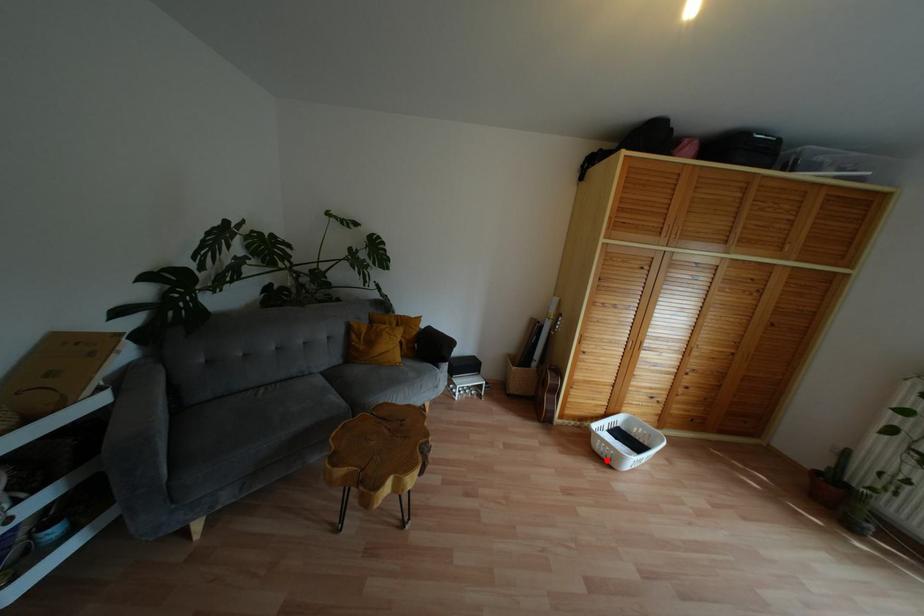
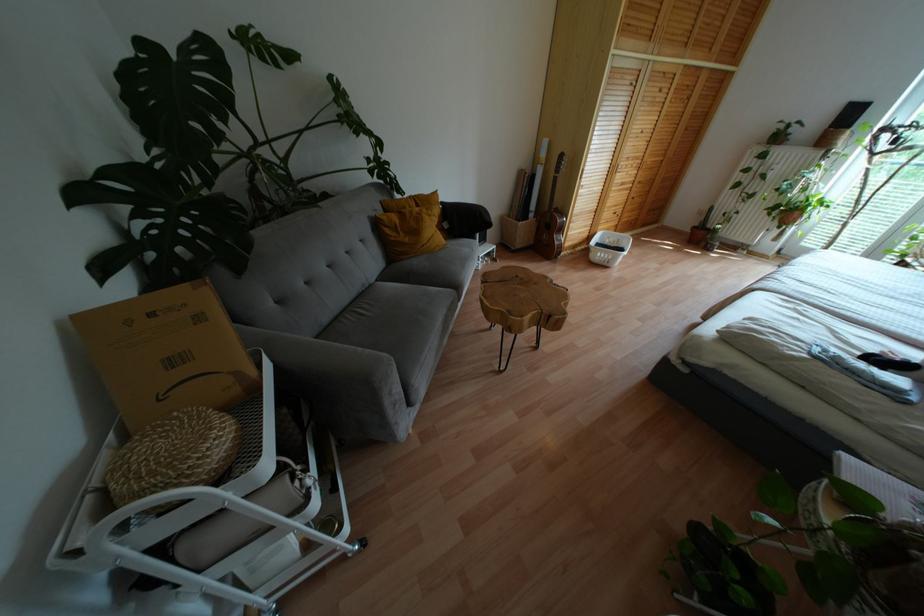
Where in the second image is the point corresponding to the highlighted location from the first image?

(604, 262)